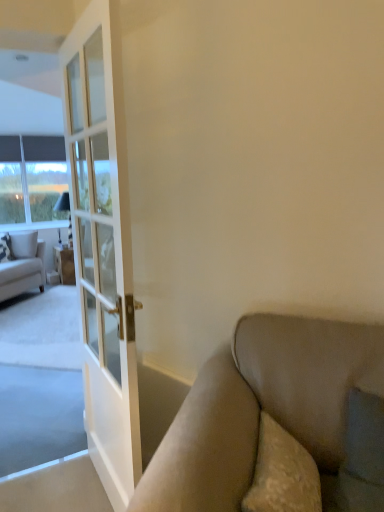
Question: Is patterned fabric pillow at left, acting as the first pillow starting from the left, smaller than matte white cabinet at left?

Choices:
 (A) no
 (B) yes

Answer: (B)

Question: Is patterned fabric pillow at left, acting as the first pillow starting from the left, completely or partially outside of matte white cabinet at left?

Choices:
 (A) yes
 (B) no

Answer: (A)

Question: From the image's perspective, is patterned fabric pillow at left, acting as the first pillow starting from the left, over matte white cabinet at left?

Choices:
 (A) yes
 (B) no

Answer: (A)

Question: From a real-world perspective, does patterned fabric pillow at left, which is the second pillow in right-to-left order, stand above matte white cabinet at left?

Choices:
 (A) yes
 (B) no

Answer: (A)

Question: Considering the relative sizes of patterned fabric pillow at left, which is the second pillow in right-to-left order, and matte white cabinet at left in the image provided, is patterned fabric pillow at left, which is the second pillow in right-to-left order, bigger than matte white cabinet at left?

Choices:
 (A) yes
 (B) no

Answer: (B)

Question: Considering the positions of clear glass window at left and matte white cabinet at left in the image, is clear glass window at left bigger or smaller than matte white cabinet at left?

Choices:
 (A) small
 (B) big

Answer: (B)

Question: Would you say clear glass window at left is inside or outside matte white cabinet at left?

Choices:
 (A) outside
 (B) inside

Answer: (A)

Question: Considering the positions of clear glass window at left and matte white cabinet at left in the image, is clear glass window at left taller or shorter than matte white cabinet at left?

Choices:
 (A) tall
 (B) short

Answer: (A)

Question: In the image, is clear glass window at left positioned in front of or behind matte white cabinet at left?

Choices:
 (A) behind
 (B) front

Answer: (A)

Question: From the image's perspective, is patterned fabric pillow at left, which is the second pillow in right-to-left order, positioned above or below white textured pillow at left, the 2th pillow from the left?

Choices:
 (A) below
 (B) above

Answer: (A)

Question: In terms of height, does patterned fabric pillow at left, which is the second pillow in right-to-left order, look taller or shorter compared to white textured pillow at left, the 2th pillow from the left?

Choices:
 (A) tall
 (B) short

Answer: (A)

Question: Is patterned fabric pillow at left, acting as the first pillow starting from the left, in front of or behind white textured pillow at left, which ranks as the 1th pillow in right-to-left order, in the image?

Choices:
 (A) behind
 (B) front

Answer: (B)

Question: Is patterned fabric pillow at left, acting as the first pillow starting from the left, bigger or smaller than white textured pillow at left, the 2th pillow from the left?

Choices:
 (A) big
 (B) small

Answer: (A)

Question: Considering the positions of white textured pillow at left, the 2th pillow from the left, and patterned fabric pillow at left, acting as the first pillow starting from the left, in the image, is white textured pillow at left, the 2th pillow from the left, bigger or smaller than patterned fabric pillow at left, acting as the first pillow starting from the left,?

Choices:
 (A) small
 (B) big

Answer: (A)

Question: Is point (36, 243) closer or farther from the camera than point (8, 256)?

Choices:
 (A) closer
 (B) farther

Answer: (B)